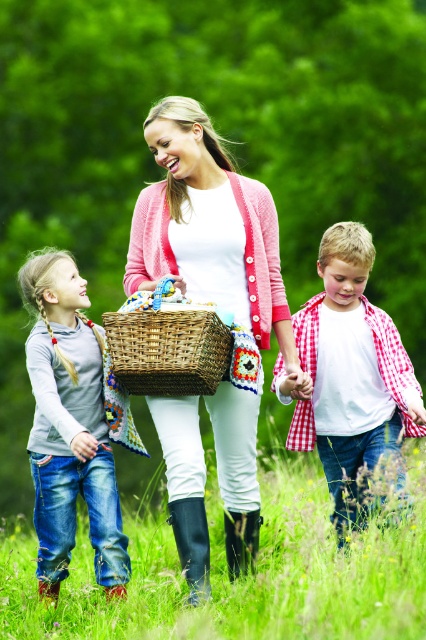
You are a photographer trying to capture a clear shot of the pink knitted cardigan at center. However, the green grass at lower center is blocking your view. Can you move the grass to get a better angle?

The green grass at lower center is in front of the pink knitted cardigan at center, so you cannot move the grass as it is part of the scene. You can try moving your camera position to angle around the grass for a clearer view of the pink knitted cardigan at center.

You are standing at point (363,317) and want to walk to point (54,534). Which direction should you move?

You should move forward because point (54,534) is in front of point (363,317).

You are a photographer planning to take a picture of the group. You want to ensure the green grass at lower center and the woven wicker basket at center are both visible in the frame. Based on their positions, which object should you focus on first to capture both in the shot?

The green grass at lower center is located below the woven wicker basket at center. To capture both in the frame, focus on the woven wicker basket at center first since it is higher up, ensuring the lower grass remains in view.